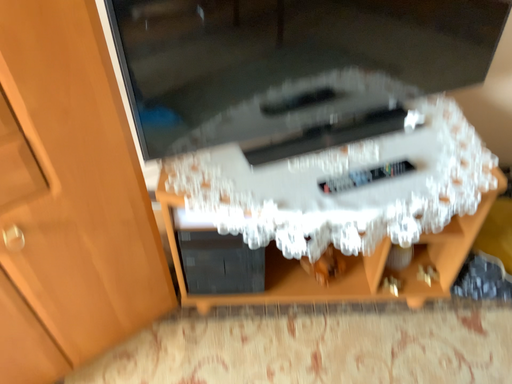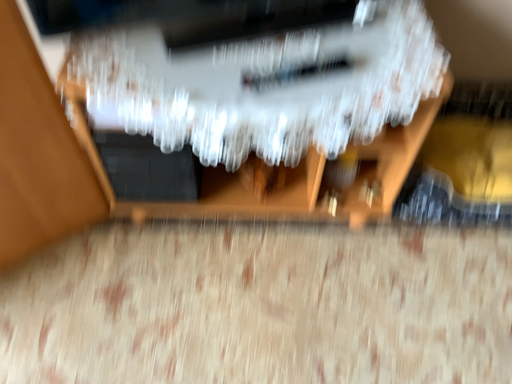
Question: How did the camera likely rotate when shooting the video?

Choices:
 (A) rotated downward
 (B) rotated upward

Answer: (A)